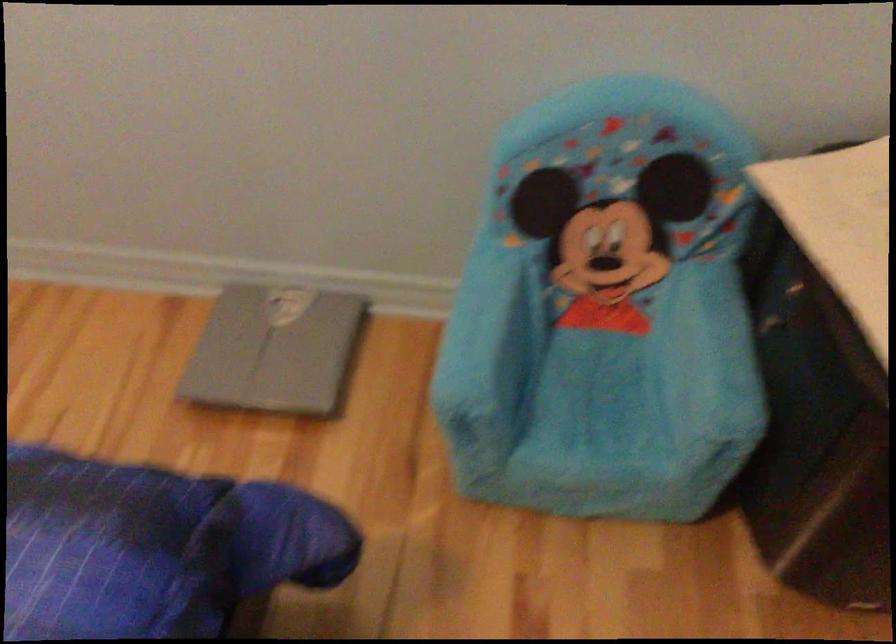
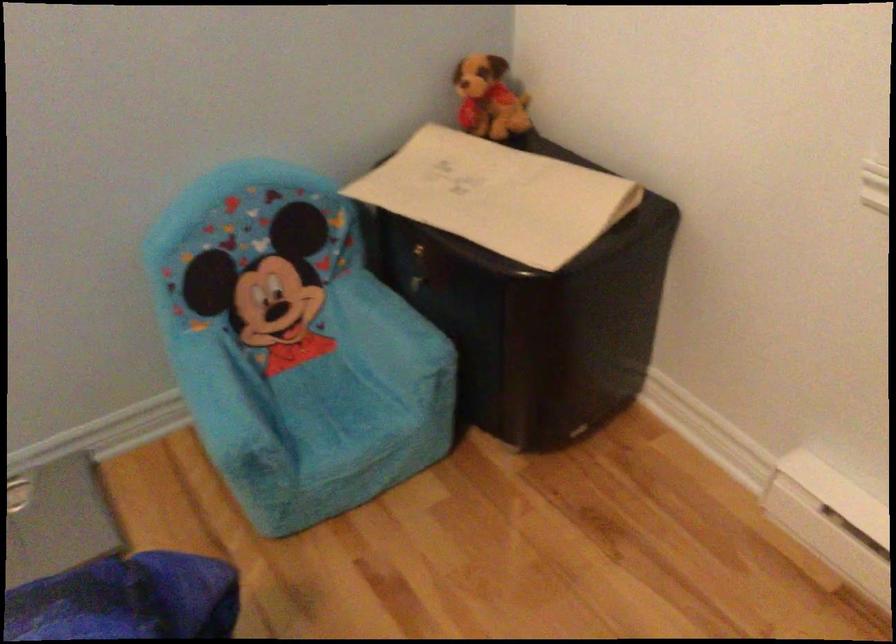
Find the pixel in the second image that matches (712,337) in the first image.

(389, 316)